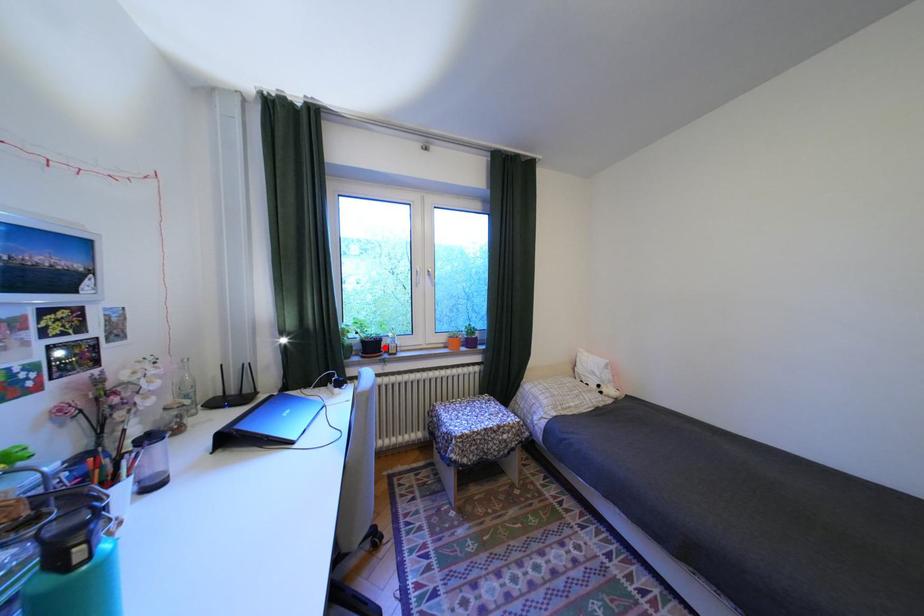
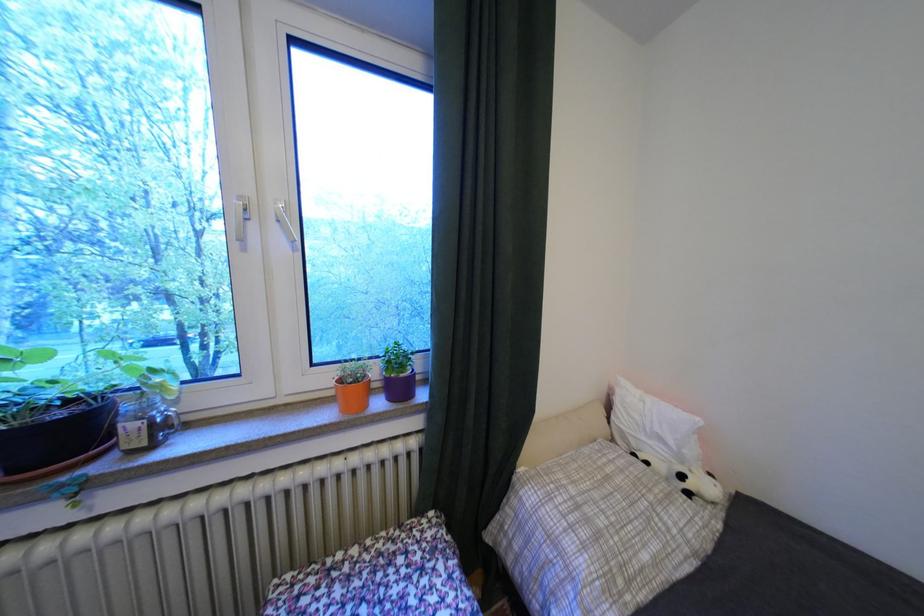
Question: I am providing you with two images of the same scene from different viewpoints. A red point is marked on the first image. At the location where the point appears in image 1, is it still visible in image 2?

Choices:
 (A) Yes
 (B) No

Answer: (A)